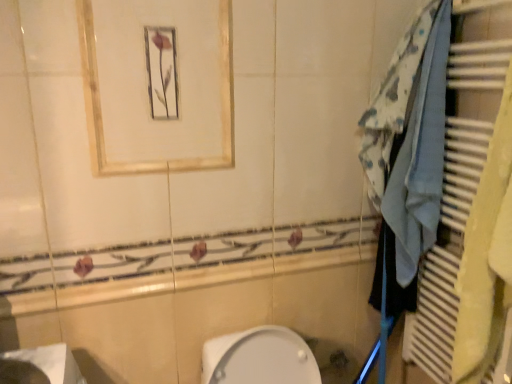
Question: From the image's perspective, would you say matte gold frame at upper center is positioned over white glossy sink at lower left?

Choices:
 (A) no
 (B) yes

Answer: (B)

Question: Would you say white glossy sink at lower left is part of matte gold frame at upper center's contents?

Choices:
 (A) no
 (B) yes

Answer: (A)

Question: From a real-world perspective, is matte gold frame at upper center physically below white glossy sink at lower left?

Choices:
 (A) yes
 (B) no

Answer: (B)

Question: Can you confirm if matte gold frame at upper center is positioned to the left of white glossy sink at lower left?

Choices:
 (A) no
 (B) yes

Answer: (A)

Question: Does matte gold frame at upper center have a lesser width compared to white glossy sink at lower left?

Choices:
 (A) no
 (B) yes

Answer: (B)

Question: Does matte gold frame at upper center come behind white glossy sink at lower left?

Choices:
 (A) no
 (B) yes

Answer: (B)

Question: From the image's perspective, is blue fabric at right under white glossy sink at lower left?

Choices:
 (A) no
 (B) yes

Answer: (A)

Question: Does blue fabric at right have a lesser width compared to white glossy sink at lower left?

Choices:
 (A) no
 (B) yes

Answer: (B)

Question: From a real-world perspective, is blue fabric at right located higher than white glossy sink at lower left?

Choices:
 (A) no
 (B) yes

Answer: (B)

Question: From the image's perspective, is blue fabric at right on white glossy sink at lower left?

Choices:
 (A) yes
 (B) no

Answer: (A)

Question: Is white glossy sink at lower left a part of blue fabric at right?

Choices:
 (A) yes
 (B) no

Answer: (B)

Question: Does blue fabric at right turn towards white glossy sink at lower left?

Choices:
 (A) yes
 (B) no

Answer: (A)

Question: From the image's perspective, is matte gold frame at upper center located above blue fabric towel at right?

Choices:
 (A) yes
 (B) no

Answer: (A)